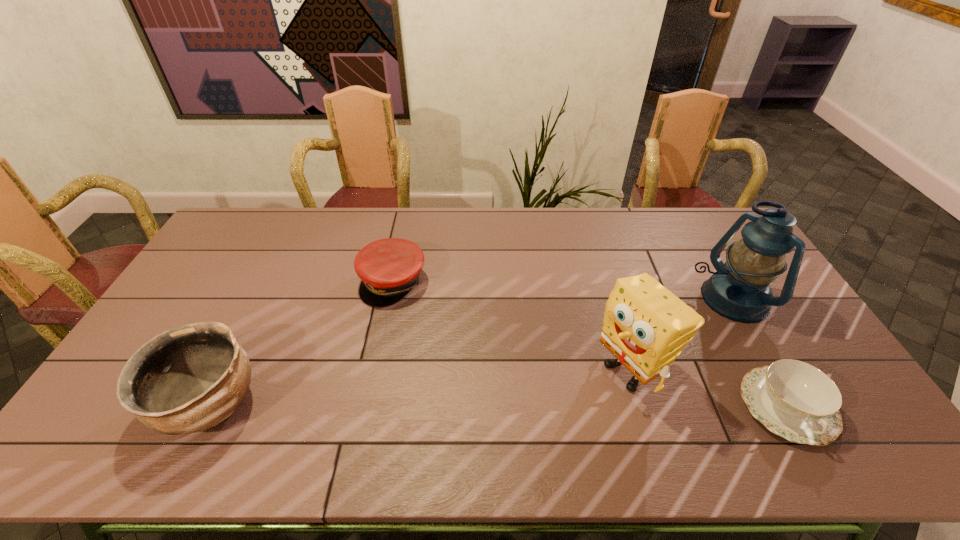
At what (x,y) coordinates should I click in order to perform the action: click on chinaware present at the right edge. Please return your answer as a coordinate pair (x, y). The image size is (960, 540). Looking at the image, I should click on point(795,400).

Locate an element on the screen. This screenshot has width=960, height=540. lantern that is positioned at the right edge is located at coordinates (739, 290).

You are a GUI agent. You are given a task and a screenshot of the screen. Output one action in this format:
    pyautogui.click(x=<x>, y=<y>)
    Task: Click on the object that is at the near left corner
    
    Given the screenshot: What is the action you would take?
    187,379

Where is `object present at the near right corner`? object present at the near right corner is located at coordinates (795, 400).

At what (x,y) coordinates should I click in order to perform the action: click on free location at the far edge. Please return your answer as a coordinate pair (x, y). Image resolution: width=960 pixels, height=540 pixels. Looking at the image, I should click on (614, 215).

This screenshot has height=540, width=960. Find the location of `vacant space at the left edge of the desktop`. vacant space at the left edge of the desktop is located at coordinates (155, 335).

In order to click on free spot between the third object from left to right and the leftmost object in this screenshot , I will do `click(420, 387)`.

I want to click on free space that is in between the third object from right to left and the shortest object, so click(708, 388).

Locate an element on the screen. unoccupied area between the chinaware and the second object from left to right is located at coordinates (589, 345).

Where is `empty space between the fourth shortest object and the leftmost object`? The image size is (960, 540). empty space between the fourth shortest object and the leftmost object is located at coordinates (420, 387).